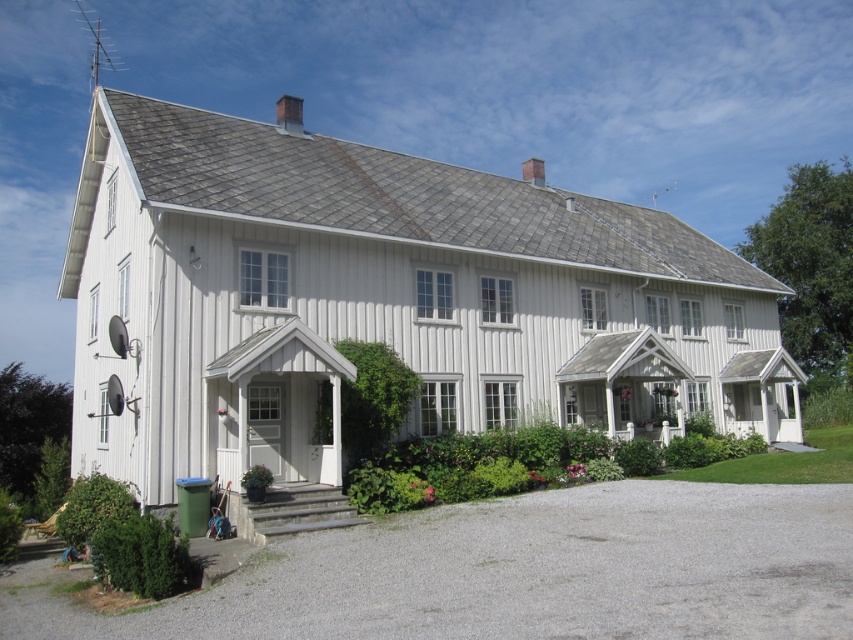
In the scene shown: Does gray gravel driveway at lower center appear on the right side of gray stone steps at lower center?

Correct, you'll find gray gravel driveway at lower center to the right of gray stone steps at lower center.

Does gray gravel driveway at lower center have a lesser height compared to gray stone steps at lower center?

No, gray gravel driveway at lower center is not shorter than gray stone steps at lower center.

The image size is (853, 640). I want to click on gray gravel driveway at lower center, so click(x=517, y=572).

I want to click on gray gravel driveway at lower center, so click(517, 572).